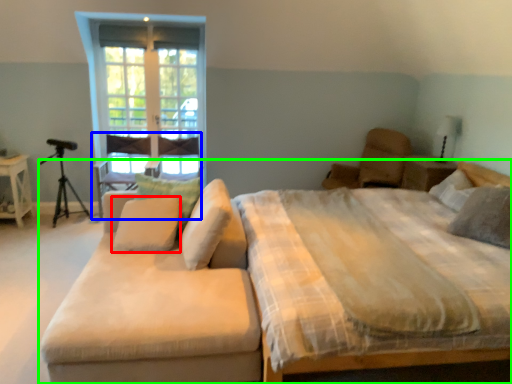
Question: Which object is positioned closest to pillow (highlighted by a red box)? Select from armchair (highlighted by a blue box) and bed (highlighted by a green box).

Choices:
 (A) armchair
 (B) bed

Answer: (B)